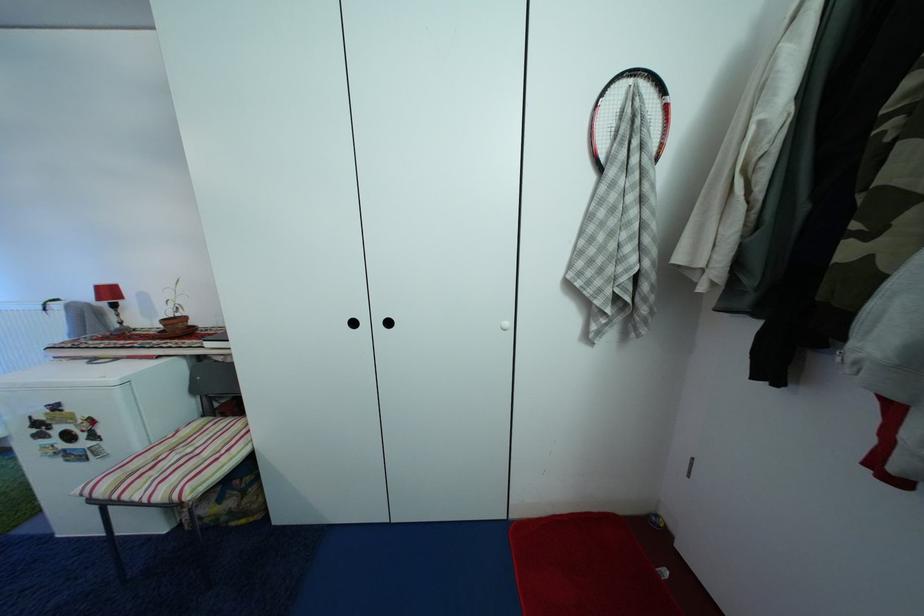
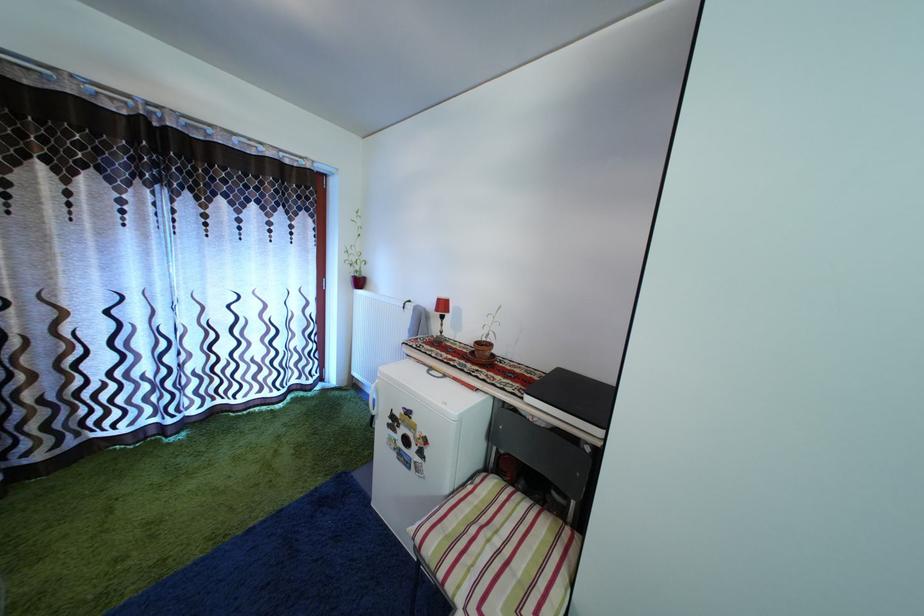
Locate, in the second image, the point that corresponds to point 198,456 in the first image.

(505, 549)